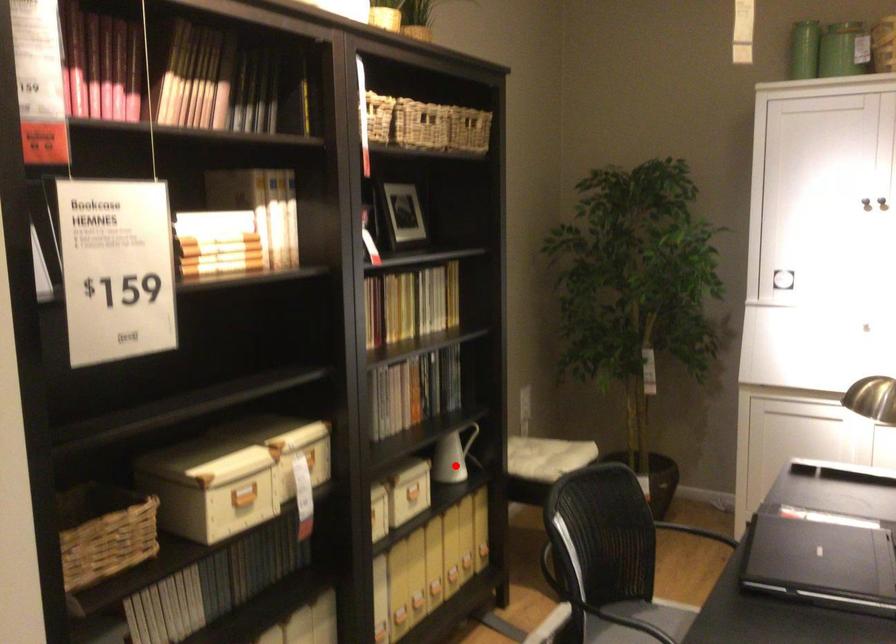
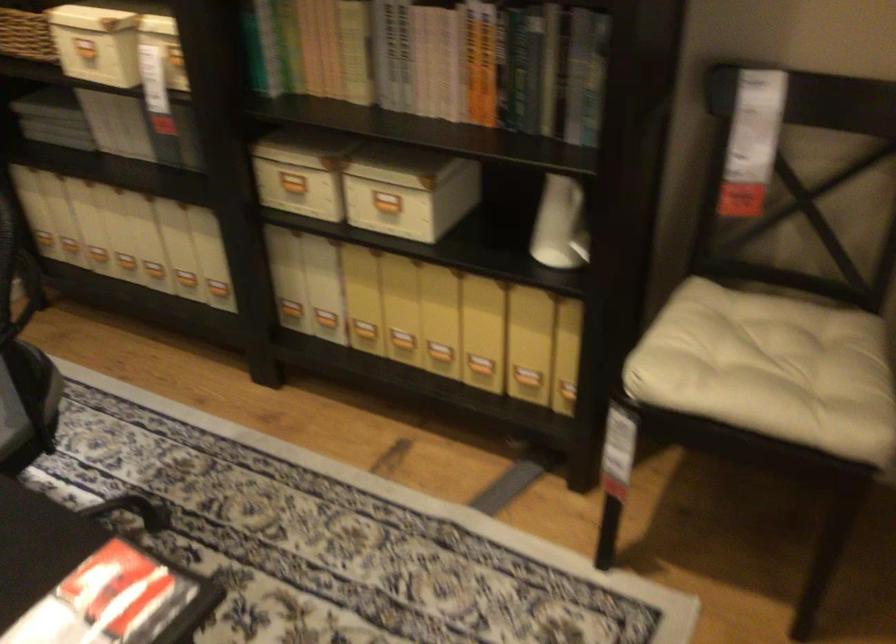
Question: I am providing you with two images of the same scene from different viewpoints. Given a red point in image1, look at the same physical point in image2. Is it:

Choices:
 (A) Closer to the viewpoint
 (B) Farther from the viewpoint

Answer: (A)